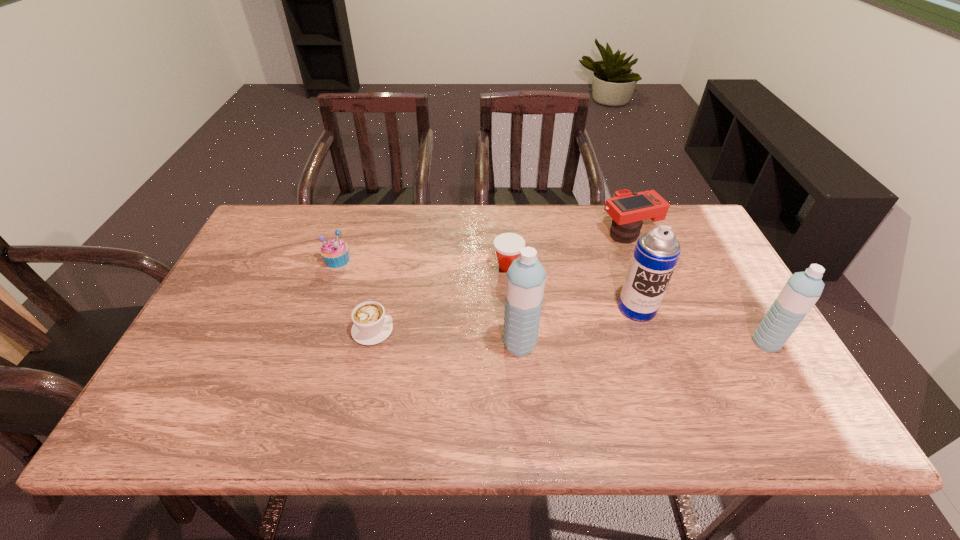
Where is `the taller water bottle`? This screenshot has width=960, height=540. the taller water bottle is located at coordinates (525, 280).

Locate an element on the screen. This screenshot has height=540, width=960. the right water bottle is located at coordinates (802, 290).

Identify the location of the shorter water bottle. Image resolution: width=960 pixels, height=540 pixels. (802, 290).

Find the location of a particular element. The width and height of the screenshot is (960, 540). the fourth tallest object is located at coordinates (628, 210).

Locate an element on the screen. This screenshot has height=540, width=960. the farthest object is located at coordinates (628, 210).

Image resolution: width=960 pixels, height=540 pixels. What are the coordinates of `aerosol can` in the screenshot? It's located at pos(656,253).

Locate an element on the screen. The width and height of the screenshot is (960, 540). the leftmost object is located at coordinates (335, 252).

The height and width of the screenshot is (540, 960). I want to click on the shortest object, so click(371, 326).

Find the location of a particular element. This screenshot has width=960, height=540. cappuccino is located at coordinates (x=371, y=326).

The image size is (960, 540). I want to click on Dixie cup, so [x=507, y=245].